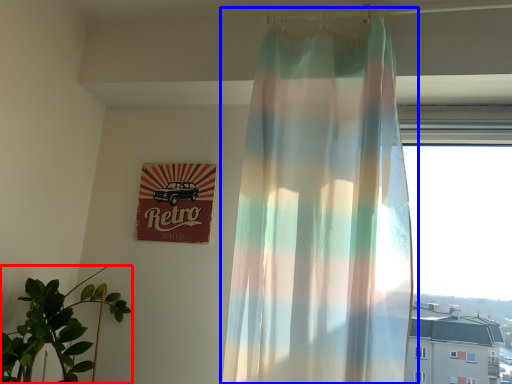
Question: Which of the following is the closest to the observer, houseplant (highlighted by a red box) or curtain (highlighted by a blue box)?

Choices:
 (A) houseplant
 (B) curtain

Answer: (B)